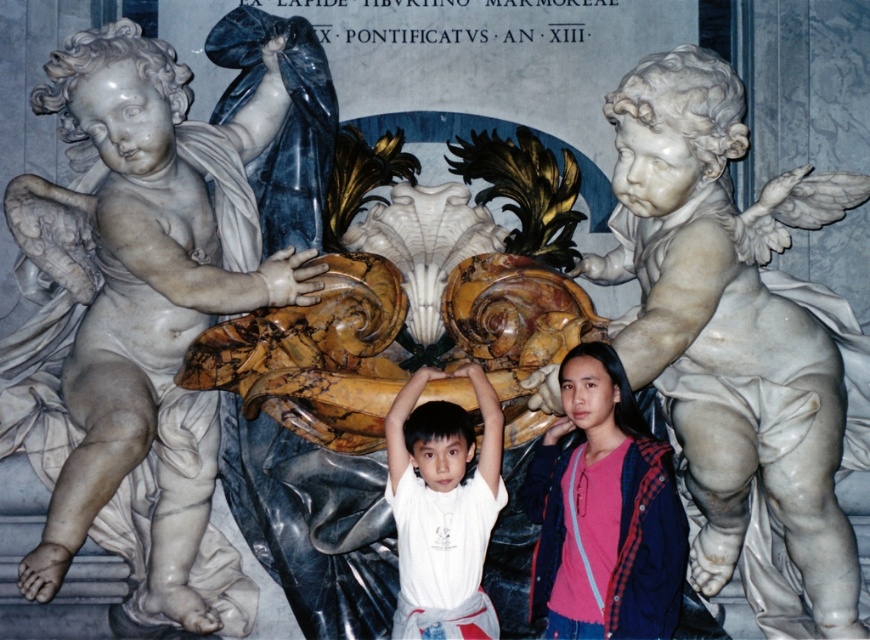
You are a GUI agent. You are given a task and a screenshot of the screen. Output one action in this format:
    pyautogui.click(x=<x>, y=<y>)
    Task: Click on the pink fabric at center
    The height and width of the screenshot is (640, 870).
    Given the screenshot: What is the action you would take?
    pyautogui.click(x=606, y=508)

Which is below, pink fabric at center or white matte shirt at center?

white matte shirt at center is lower down.

Where is `pink fabric at center`? The width and height of the screenshot is (870, 640). pink fabric at center is located at coordinates (606, 508).

Is white marble cherub at left wider than pink fabric at center?

Yes.

Describe the element at coordinates (137, 321) in the screenshot. I see `white marble cherub at left` at that location.

Locate an element on the screen. white marble cherub at left is located at coordinates (137, 321).

Can you confirm if white marble cherub at left is positioned above white matte shirt at center?

Yes, white marble cherub at left is above white matte shirt at center.

Is white marble cherub at left behind white matte shirt at center?

That is True.

Which is behind, point (85, 516) or point (420, 490)?

The point (85, 516) is more distant.

Find the location of `white marble cherub at left`. white marble cherub at left is located at coordinates (137, 321).